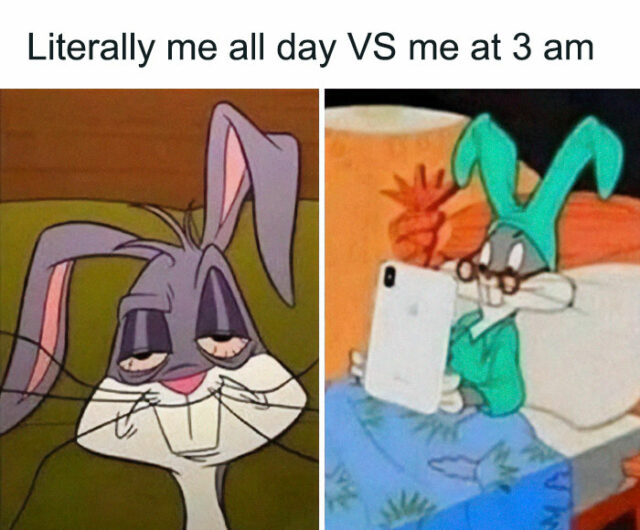
Identify the location of blanket. The image size is (640, 530). (445, 484).